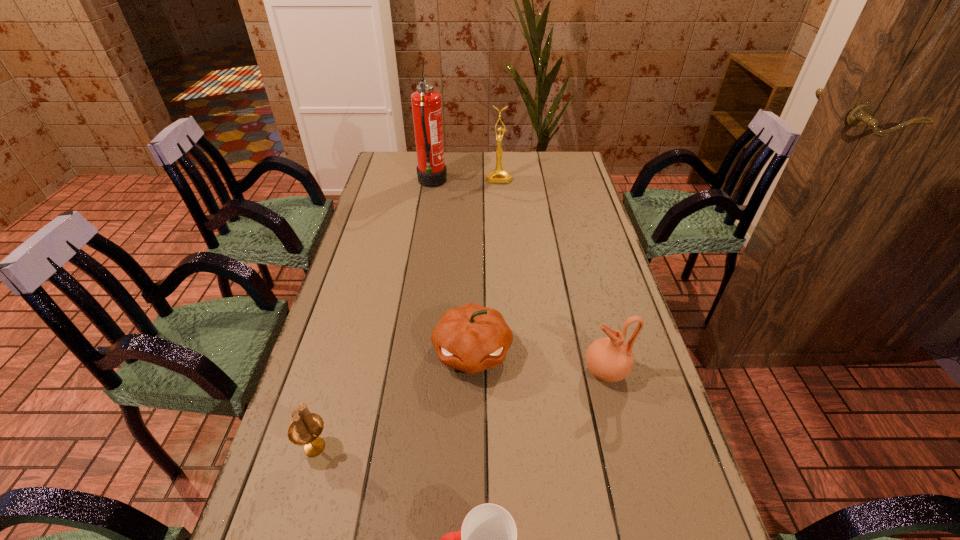
Identify the location of object that stands as the third closest to the second tallest object. This screenshot has width=960, height=540. (609, 359).